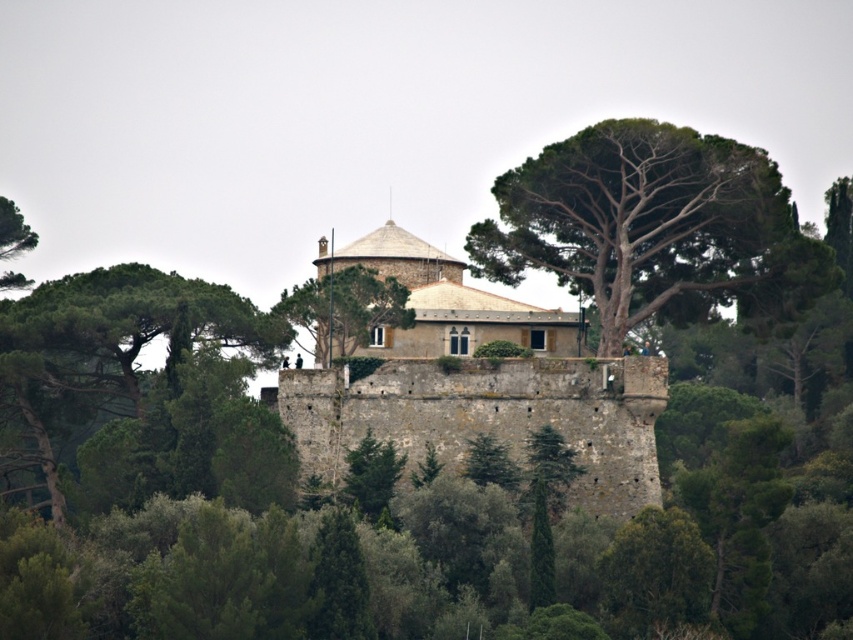
Which is in front, point (596, 397) or point (375, 321)?

Point (596, 397)

Is stone castle at center further to camera compared to green leafy tree at center?

That is False.

Does point (624, 500) come farther from viewer compared to point (405, 314)?

No, it is in front of (405, 314).

Where is `stone castle at center`? stone castle at center is located at coordinates (476, 381).

Does stone castle at center appear on the left side of green leafy tree at left?

No, stone castle at center is not to the left of green leafy tree at left.

Which is behind, point (599, 426) or point (22, 221)?

Point (22, 221)

I want to click on stone castle at center, so click(x=476, y=381).

Between green rough bark tree at center and green leafy tree at left, which one appears on the right side from the viewer's perspective?

green rough bark tree at center is more to the right.

Which is more to the left, green rough bark tree at center or green leafy tree at left?

green leafy tree at left

Describe the element at coordinates (643, 221) in the screenshot. I see `green rough bark tree at center` at that location.

This screenshot has height=640, width=853. I want to click on green rough bark tree at center, so click(x=643, y=221).